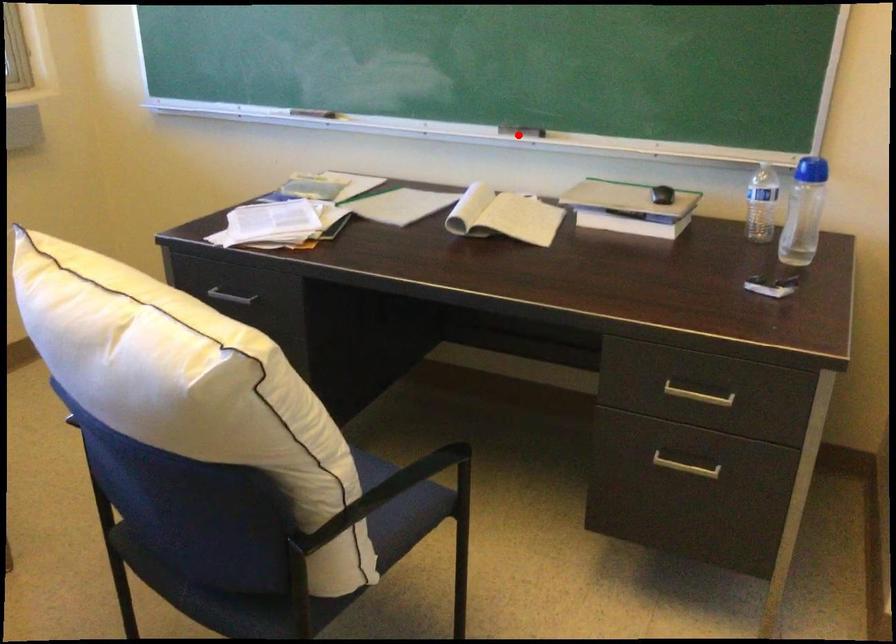
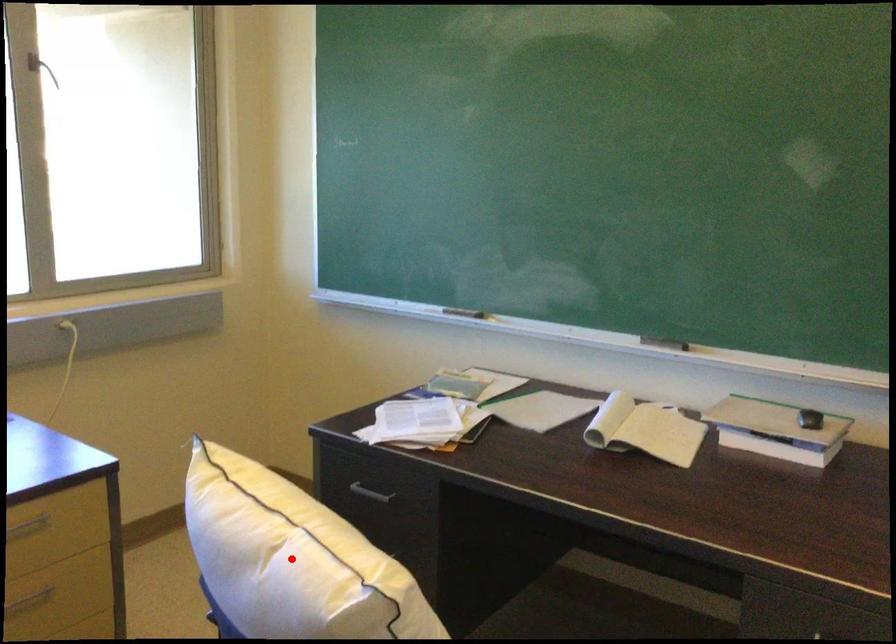
I am providing you with two images of the same scene from different viewpoints. A red point is marked on the first image and another point is marked on the second image. Does the point marked in image1 correspond to the same location as the one in image2?

No